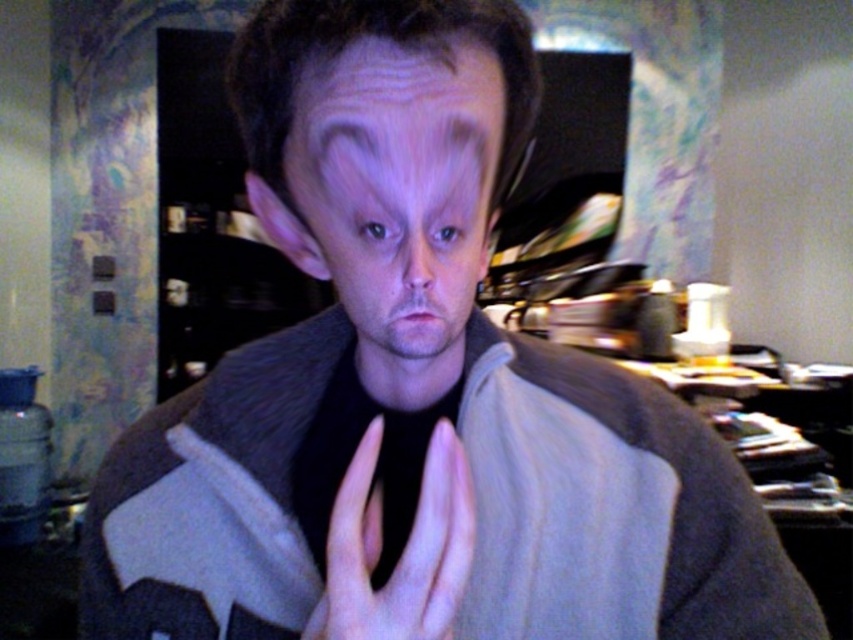
Question: Can you confirm if matte gray hair at center is smaller than skinny white hand at center?

Choices:
 (A) no
 (B) yes

Answer: (A)

Question: Which object is closer to the camera taking this photo?

Choices:
 (A) matte gray hair at center
 (B) skinny white hand at center

Answer: (B)

Question: Is matte gray hair at center positioned in front of skinny white hand at center?

Choices:
 (A) yes
 (B) no

Answer: (B)

Question: Which point is closer to the camera?

Choices:
 (A) matte gray hair at center
 (B) skinny white hand at center

Answer: (B)

Question: Which of the following is the closest to the observer?

Choices:
 (A) matte gray hair at center
 (B) skinny white hand at center

Answer: (B)

Question: Can you confirm if matte gray hair at center is thinner than skinny white hand at center?

Choices:
 (A) no
 (B) yes

Answer: (A)